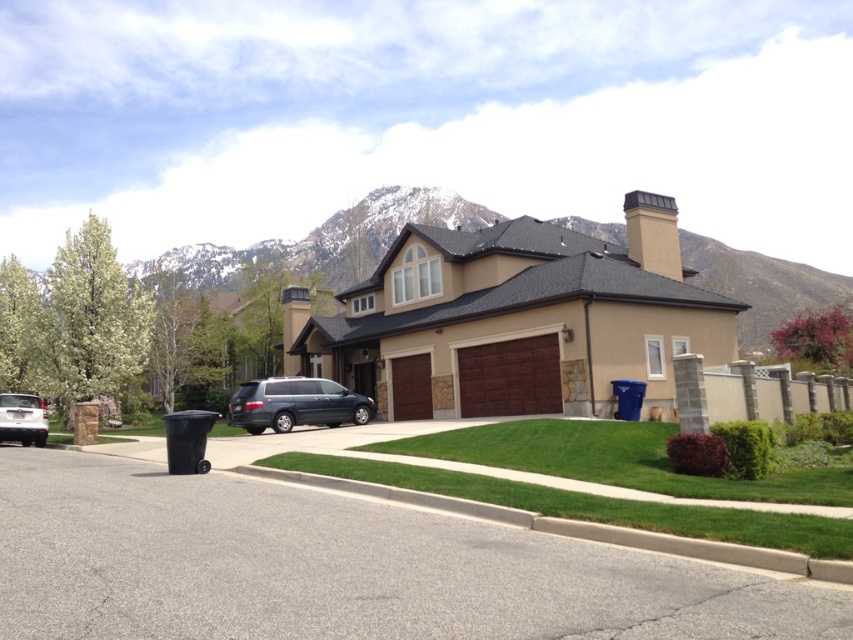
You are standing at the front door of the house and want to throw away some trash. There is a blue trash bin located at point (x=517, y=320). Is the blue trash bin closer to the brown wood glass garage at center or to the chimney on the right side of the house?

The brown wood glass garage at center is represented by point (x=517, y=320), so the blue trash bin is exactly at the location of the brown wood glass garage at center. Therefore, it is closer to the brown wood glass garage at center than the chimney on the right side of the house.